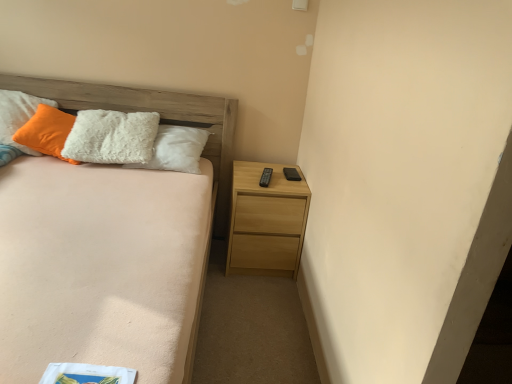
Question: Should I look upward or downward to see light wood nightstand at lower right?

Choices:
 (A) up
 (B) down

Answer: (B)

Question: Is light brown wooden bed at left positioned beyond the bounds of white fluffy pillow at upper left?

Choices:
 (A) no
 (B) yes

Answer: (B)

Question: Does light brown wooden bed at left have a smaller size compared to white fluffy pillow at upper left?

Choices:
 (A) no
 (B) yes

Answer: (A)

Question: Does light brown wooden bed at left have a lesser width compared to white fluffy pillow at upper left?

Choices:
 (A) no
 (B) yes

Answer: (A)

Question: Is light brown wooden bed at left bigger than white fluffy pillow at upper left?

Choices:
 (A) no
 (B) yes

Answer: (B)

Question: Is the position of light brown wooden bed at left less distant than that of white fluffy pillow at upper left?

Choices:
 (A) no
 (B) yes

Answer: (B)

Question: Is light brown wooden bed at left looking in the opposite direction of white fluffy pillow at upper left?

Choices:
 (A) no
 (B) yes

Answer: (B)

Question: From the image's perspective, is light wood nightstand at lower right above light brown wooden bed at left?

Choices:
 (A) yes
 (B) no

Answer: (A)

Question: Does light wood nightstand at lower right appear on the left side of light brown wooden bed at left?

Choices:
 (A) no
 (B) yes

Answer: (A)

Question: Is light brown wooden bed at left at the back of light wood nightstand at lower right?

Choices:
 (A) yes
 (B) no

Answer: (B)

Question: Is light wood nightstand at lower right taller than light brown wooden bed at left?

Choices:
 (A) no
 (B) yes

Answer: (A)

Question: Is light wood nightstand at lower right directly adjacent to light brown wooden bed at left?

Choices:
 (A) no
 (B) yes

Answer: (A)

Question: Is light wood nightstand at lower right to the right of light brown wooden bed at left from the viewer's perspective?

Choices:
 (A) no
 (B) yes

Answer: (B)

Question: Could you tell me if white fluffy pillow at upper left is turned towards light brown wooden bed at left?

Choices:
 (A) no
 (B) yes

Answer: (B)